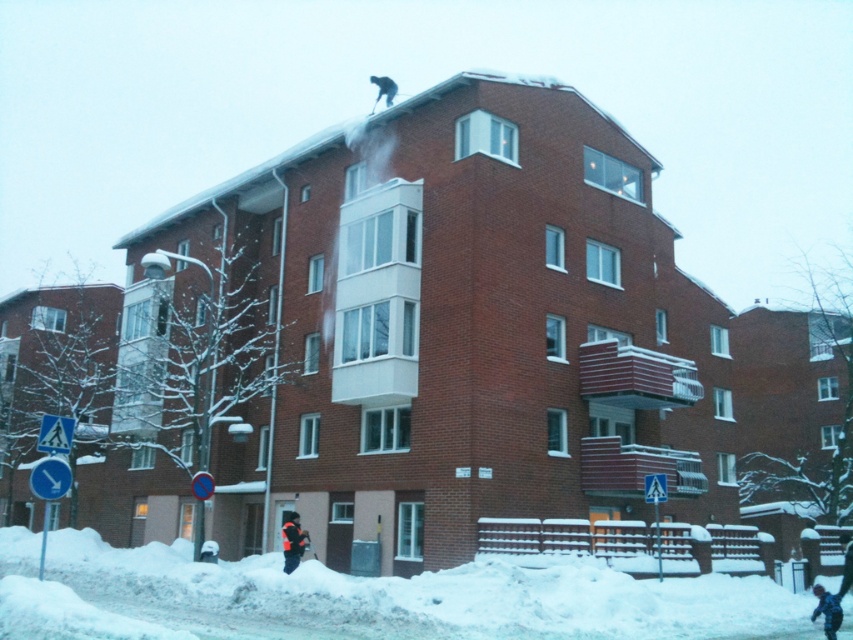
You are a delivery person trying to reach the front door of the building. You see the white fluffy snow at lower center and the blue fabric jacket at lower right. Which object is closer to the building?

The white fluffy snow at lower center is closer to the building because it is located to the left of the blue fabric jacket at lower right, which is further away from the building.

You are standing at the base of the building and looking up. There is a point marked at coordinates (292,541) on the orange fleece jacket at upper center. If you were to throw a snowball straight ahead, would it hit the building or land on the snow below?

The point (292,541) is on the orange fleece jacket at upper center. Since the jacket is on a person standing on the roof, throwing a snowball straight ahead would likely hit the building wall below the jacket or land on the snow further down, depending on the throw force. However, without knowing the exact trajectory, it is uncertain. But given the jacket is on the roof, the snowball would either hit the building or land on the snow, not beyond.